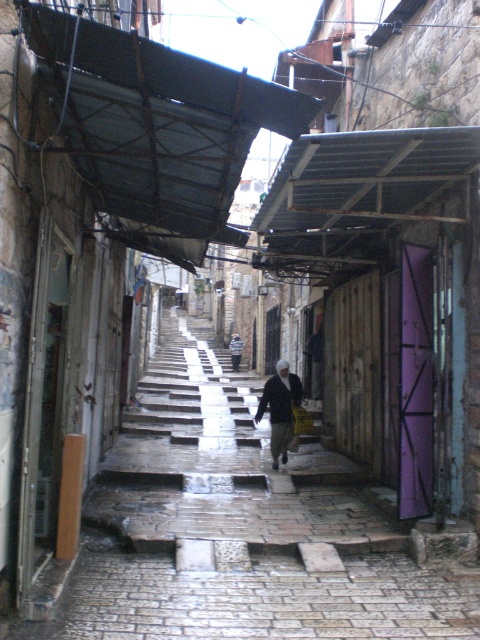
Is dark gray woolen jacket at center above striped fabric jacket at center?

No.

Is dark gray woolen jacket at center to the right of striped fabric jacket at center from the viewer's perspective?

Correct, you'll find dark gray woolen jacket at center to the right of striped fabric jacket at center.

Does point (273, 397) come farther from viewer compared to point (237, 336)?

That is False.

This screenshot has height=640, width=480. What are the coordinates of `dark gray woolen jacket at center` in the screenshot? It's located at (279, 397).

Is metallic corrugated roof at upper center thinner than white woolen hat at center?

No.

Is metallic corrugated roof at upper center to the right of white woolen hat at center from the viewer's perspective?

No, metallic corrugated roof at upper center is not to the right of white woolen hat at center.

Between point (40, 54) and point (285, 372), which one is positioned in front?

Positioned in front is point (40, 54).

Find the location of a particular element. metallic corrugated roof at upper center is located at coordinates (156, 120).

Is stone textured stairs at center to the right of white woolen hat at center from the viewer's perspective?

No, stone textured stairs at center is not to the right of white woolen hat at center.

Does stone textured stairs at center have a greater width compared to white woolen hat at center?

Yes.

Is point (357, 480) less distant than point (266, 388)?

Yes, it is in front of point (266, 388).

Locate an element on the screen. stone textured stairs at center is located at coordinates (224, 468).